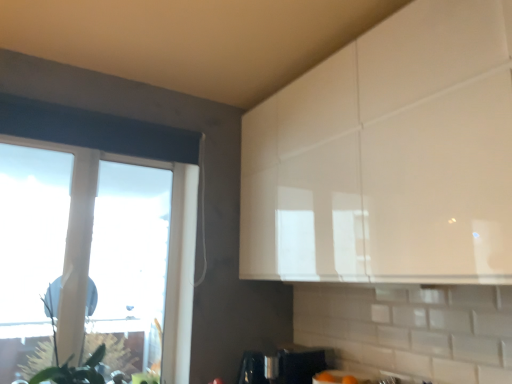
Locate an element on the screen. The height and width of the screenshot is (384, 512). satin silver coffee maker at lower center is located at coordinates tap(285, 365).

The image size is (512, 384). I want to click on satin silver coffee maker at lower center, so click(x=285, y=365).

Is green matte plant at left not inside transparent glass window at left?

Indeed, green matte plant at left is completely outside transparent glass window at left.

Is green matte plant at left wider or thinner than transparent glass window at left?

green matte plant at left is wider than transparent glass window at left.

The height and width of the screenshot is (384, 512). I want to click on window that is on the left side of green matte plant at left, so click(x=98, y=133).

From the image's perspective, is green matte plant at left positioned above or below transparent glass window at left?

green matte plant at left is situated lower than transparent glass window at left in the image.

How different are the orientations of transparent glass window at left and green matte plant at left in degrees?

transparent glass window at left and green matte plant at left are facing 4.18 degrees away from each other.

Which is more to the right, transparent glass window at left or green matte plant at left?

Positioned to the right is green matte plant at left.

Is transparent glass window at left behind green matte plant at left?

That is True.

Identify the location of appliance below the green matte plant at left (from a real-world perspective). Image resolution: width=512 pixels, height=384 pixels. (285, 365).

Visually, is satin silver coffee maker at lower center positioned to the left or to the right of green matte plant at left?

Clearly, satin silver coffee maker at lower center is on the right of green matte plant at left in the image.

Looking at their sizes, would you say satin silver coffee maker at lower center is wider or thinner than green matte plant at left?

satin silver coffee maker at lower center is wider than green matte plant at left.

Does satin silver coffee maker at lower center turn towards green matte plant at left?

No, satin silver coffee maker at lower center does not turn towards green matte plant at left.

From a real-world perspective, which object rests below the other?

In real-world perspective, satin silver coffee maker at lower center is lower.

Looking at this image, from the image's perspective, which object appears higher, green matte plant at left or satin silver coffee maker at lower center?

green matte plant at left is shown above in the image.

Does green matte plant at left have a lesser width compared to satin silver coffee maker at lower center?

Correct, the width of green matte plant at left is less than that of satin silver coffee maker at lower center.

Is green matte plant at left positioned far away from satin silver coffee maker at lower center?

Yes, green matte plant at left is far from satin silver coffee maker at lower center.

Considering the positions of point (203, 211) and point (317, 353), is point (203, 211) closer or farther from the camera than point (317, 353)?

Point (203, 211) is farther from the camera than point (317, 353).

Which object is closer to the camera taking this photo, transparent glass window at left or satin silver coffee maker at lower center?

transparent glass window at left is closer to the camera.

From the image's perspective, is transparent glass window at left above or below satin silver coffee maker at lower center?

transparent glass window at left is situated higher than satin silver coffee maker at lower center in the image.

Could you tell me if satin silver coffee maker at lower center is facing transparent glass window at left?

No, satin silver coffee maker at lower center is not turned towards transparent glass window at left.

Based on the photo, based on their positions, is satin silver coffee maker at lower center located to the left or right of transparent glass window at left?

Based on their positions, satin silver coffee maker at lower center is located to the right of transparent glass window at left.

Is there a large distance between satin silver coffee maker at lower center and transparent glass window at left?

Yes, satin silver coffee maker at lower center and transparent glass window at left are located far from each other.

Which of these two, satin silver coffee maker at lower center or transparent glass window at left, is smaller?

satin silver coffee maker at lower center.

I want to click on plant in front of the transparent glass window at left, so click(116, 350).

Locate an element on the screen. The width and height of the screenshot is (512, 384). window positioned vertically above the green matte plant at left (from a real-world perspective) is located at coordinates (98, 133).

Looking at the image, which one is located closer to green matte plant at left, transparent glass window at left or satin silver coffee maker at lower center?

satin silver coffee maker at lower center.

Based on their spatial positions, is satin silver coffee maker at lower center or green matte plant at left closer to transparent glass window at left?

Based on the image, satin silver coffee maker at lower center appears to be nearer to transparent glass window at left.

Looking at this image, based on their spatial positions, is green matte plant at left or satin silver coffee maker at lower center further from transparent glass window at left?

Based on the image, green matte plant at left appears to be further to transparent glass window at left.

Which object lies further to the anchor point satin silver coffee maker at lower center, transparent glass window at left or green matte plant at left?

green matte plant at left is positioned further to the anchor satin silver coffee maker at lower center.

From the image, which object appears to be nearer to green matte plant at left, satin silver coffee maker at lower center or transparent glass window at left?

satin silver coffee maker at lower center is positioned closer to the anchor green matte plant at left.

When comparing their distances from satin silver coffee maker at lower center, does green matte plant at left or transparent glass window at left seem closer?

transparent glass window at left is positioned closer to the anchor satin silver coffee maker at lower center.

The image size is (512, 384). I want to click on plant located between transparent glass window at left and satin silver coffee maker at lower center in the left-right direction, so click(x=116, y=350).